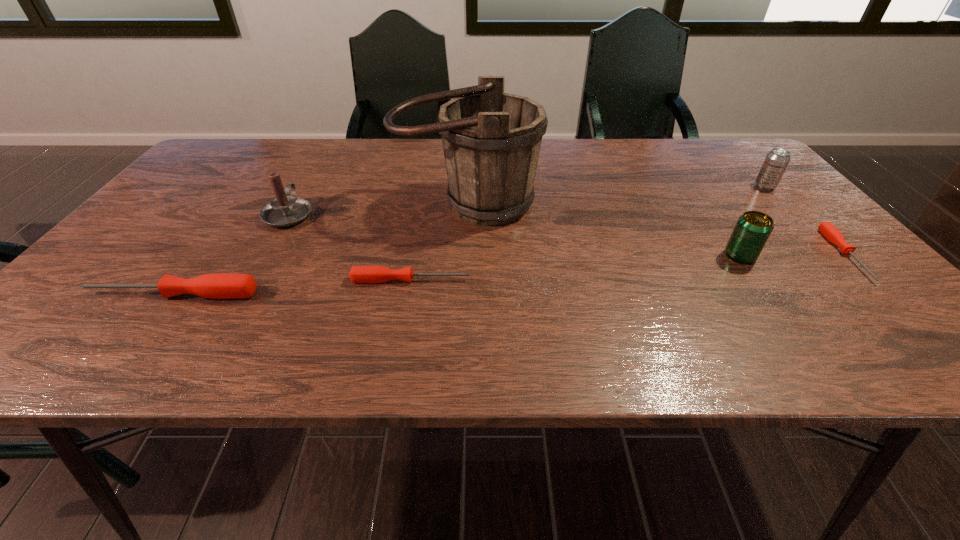
Identify which object is the fifth nearest to the second screwdriver from right to left. Please provide its 2D coordinates. Your answer should be formatted as a tuple, i.e. [(x, y)], where the tuple contains the x and y coordinates of a point satisfying the conditions above.

[(830, 232)]

Identify which screwdriver is the second nearest to the shortest object. Please provide its 2D coordinates. Your answer should be formatted as a tuple, i.e. [(x, y)], where the tuple contains the x and y coordinates of a point satisfying the conditions above.

[(218, 286)]

Locate which screwdriver is the second closest to the shortest screwdriver. Please provide its 2D coordinates. Your answer should be formatted as a tuple, i.e. [(x, y)], where the tuple contains the x and y coordinates of a point satisfying the conditions above.

[(218, 286)]

I want to click on free location that satisfies the following two spatial constraints: 1. on the side of the right beer can with the handle loop; 2. on the right side of the second tallest object, so click(305, 186).

Where is `free point that satisfies the following two spatial constraints: 1. at the tip of the shortest object; 2. at the tip of the nearest screwdriver`? Image resolution: width=960 pixels, height=540 pixels. free point that satisfies the following two spatial constraints: 1. at the tip of the shortest object; 2. at the tip of the nearest screwdriver is located at coordinates (883, 294).

Identify the location of vacant region that satisfies the following two spatial constraints: 1. on the handle side of the tallest object; 2. on the right side of the fifth object from left to right. (465, 256).

Find the location of a particular element. The image size is (960, 540). free space that satisfies the following two spatial constraints: 1. on the front side of the nearer beer can; 2. at the tip of the second tallest screwdriver is located at coordinates (756, 280).

Find the location of a particular element. This screenshot has width=960, height=540. vacant space that satisfies the following two spatial constraints: 1. on the front side of the right beer can; 2. at the tip of the tallest screwdriver is located at coordinates (865, 294).